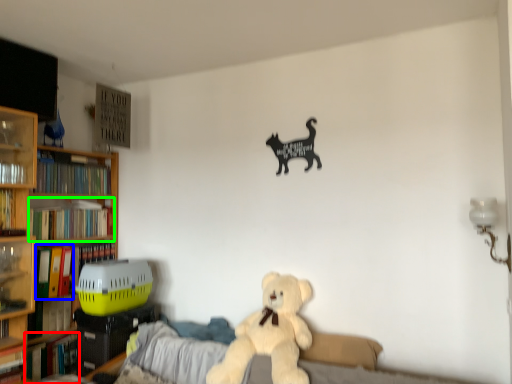
Question: Considering the real-world distances, which object is closest to book (highlighted by a red box)? book (highlighted by a blue box) or book (highlighted by a green box).

Choices:
 (A) book
 (B) book

Answer: (A)